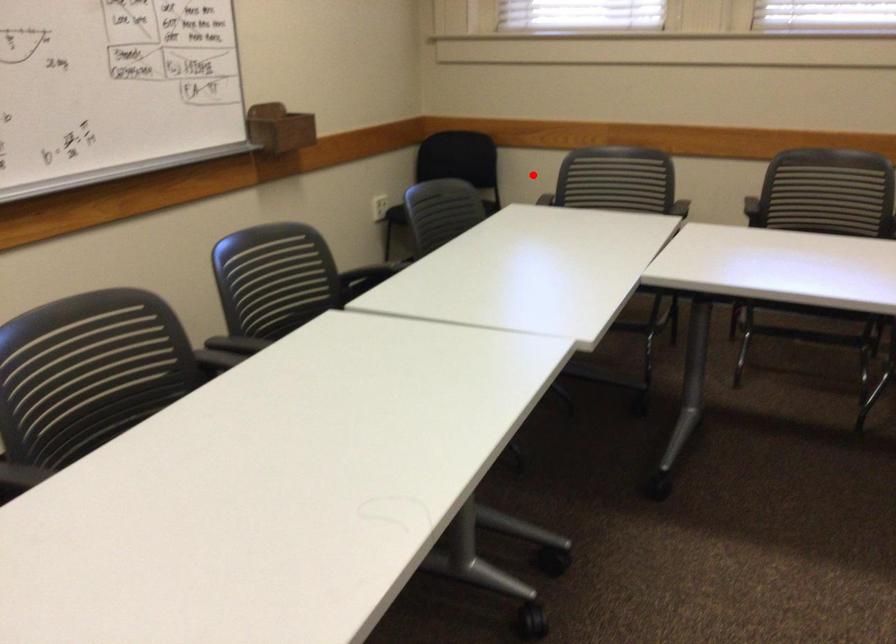
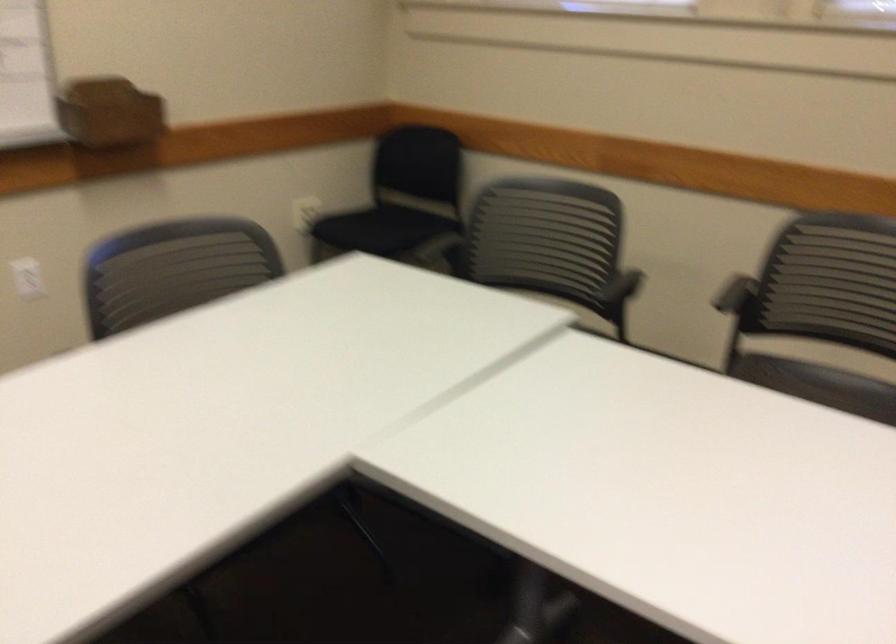
Question: I am providing you with two images of the same scene from different viewpoints. A red point is marked on the first image. Is the red point's position out of view in image 2?

Choices:
 (A) Yes
 (B) No

Answer: (A)